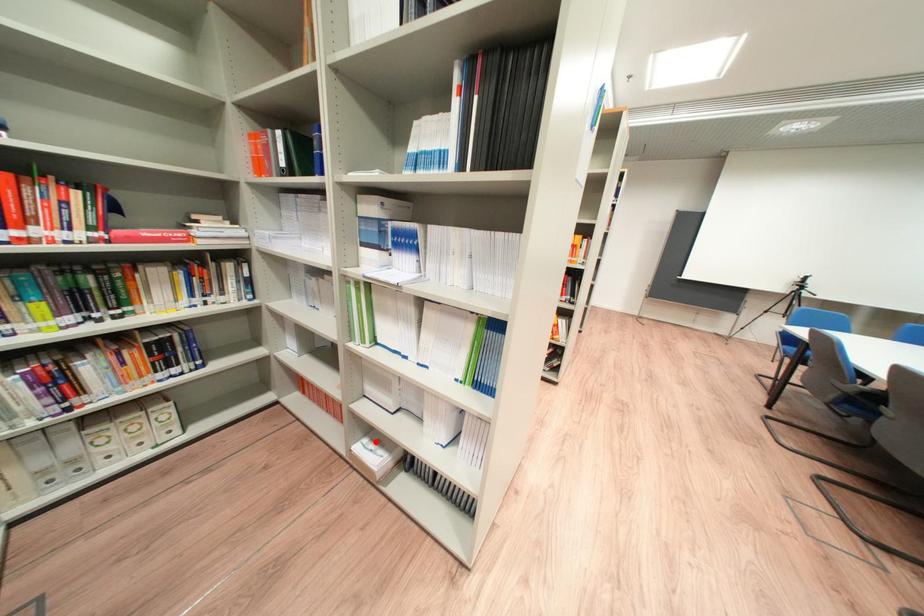
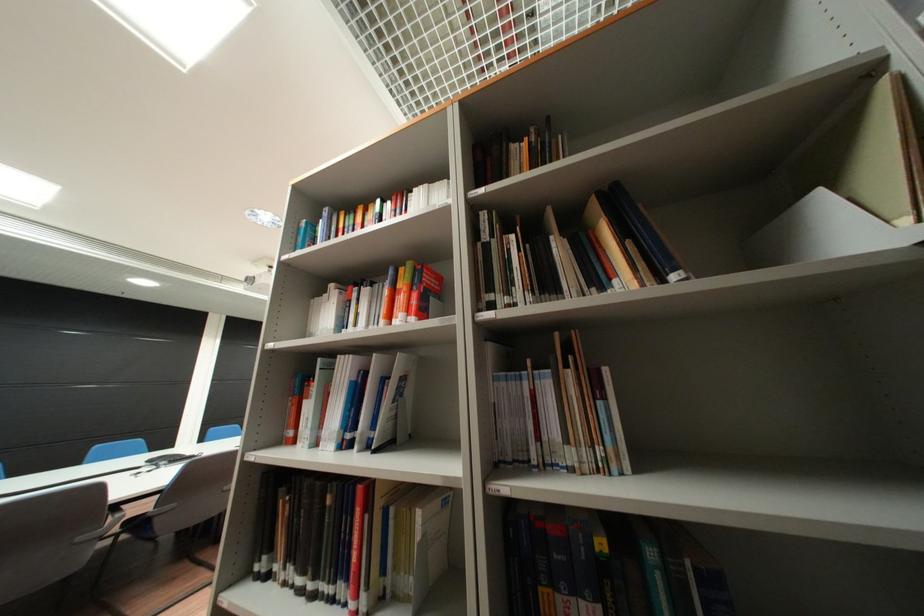
Question: I am providing you with two images of the same scene from different viewpoints. A red point is marked on the first image. Is the red point's position out of view in image 2?

Choices:
 (A) Yes
 (B) No

Answer: (A)